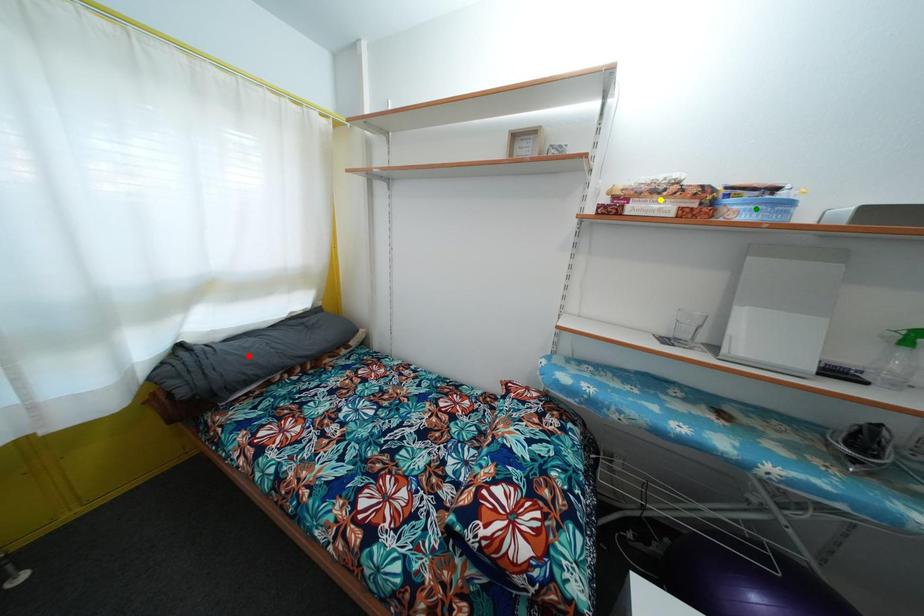
Order these from nearest to farthest:
1. green point
2. red point
3. yellow point

red point, yellow point, green point